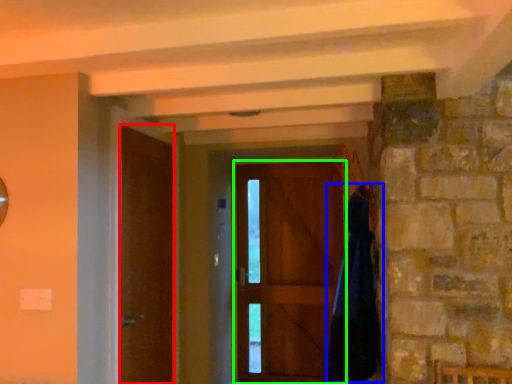
Question: Estimate the real-world distances between objects in this image. Which object is farther from door (highlighted by a red box), cloak (highlighted by a blue box) or door (highlighted by a green box)?

Choices:
 (A) cloak
 (B) door

Answer: (B)